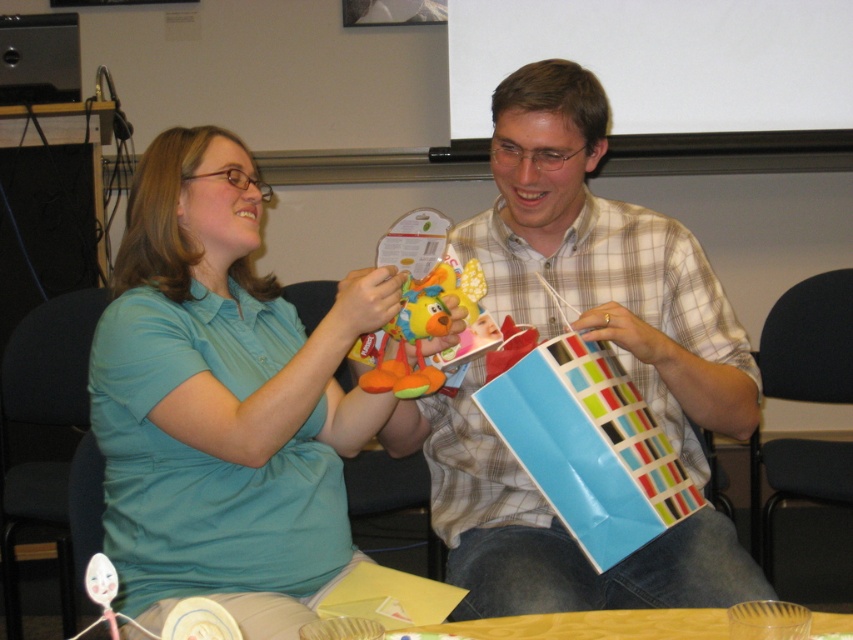
Who is shorter, plaid shirt at center or soft plush toy at center?

soft plush toy at center is shorter.

Who is more distant from viewer, (399, 449) or (442, 285)?

The point (399, 449) is more distant.

You are a GUI agent. You are given a task and a screenshot of the screen. Output one action in this format:
    pyautogui.click(x=<x>, y=<y>)
    Task: Click on the plaid shirt at center
    
    Given the screenshot: What is the action you would take?
    pyautogui.click(x=605, y=260)

Which of these two, teal matte shirt at upper left or plaid shirt at center, stands shorter?

With less height is teal matte shirt at upper left.

Can you confirm if teal matte shirt at upper left is positioned below plaid shirt at center?

Correct, teal matte shirt at upper left is located below plaid shirt at center.

Find the location of a particular element. The height and width of the screenshot is (640, 853). teal matte shirt at upper left is located at coordinates (223, 401).

Who is more distant from viewer, (167, 260) or (465, 348)?

The point (167, 260) is behind.

Between point (210, 541) and point (431, 326), which one is positioned in front?

Positioned in front is point (431, 326).

The image size is (853, 640). What do you see at coordinates (223, 401) in the screenshot?
I see `teal matte shirt at upper left` at bounding box center [223, 401].

Identify the location of teal matte shirt at upper left. (223, 401).